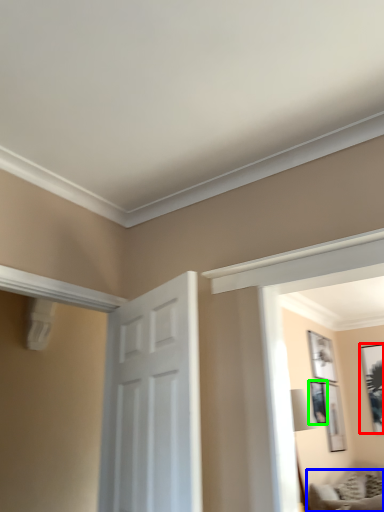
Question: Which is farther away from picture frame (highlighted by a red box)? furniture (highlighted by a blue box) or picture frame (highlighted by a green box)?

Choices:
 (A) furniture
 (B) picture frame

Answer: (A)